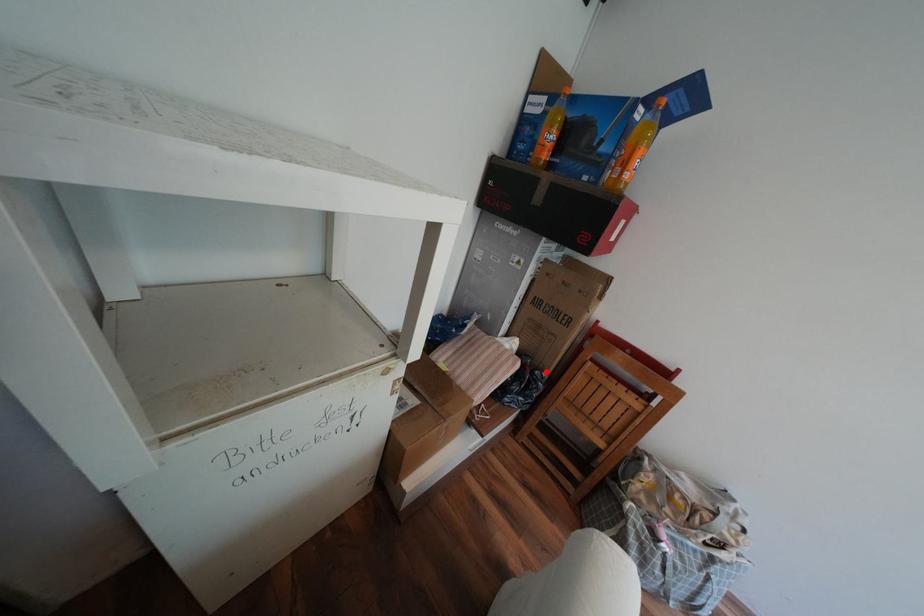
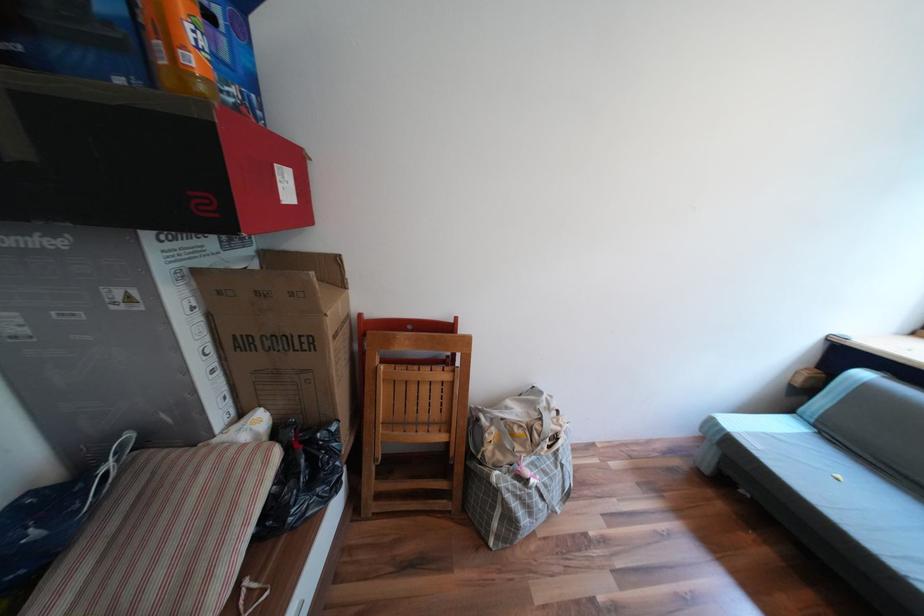
Question: I am providing you with two images of the same scene from different viewpoints. Given a red point in image1, look at the same physical point in image2. Is it:

Choices:
 (A) Closer to the viewpoint
 (B) Farther from the viewpoint

Answer: (A)